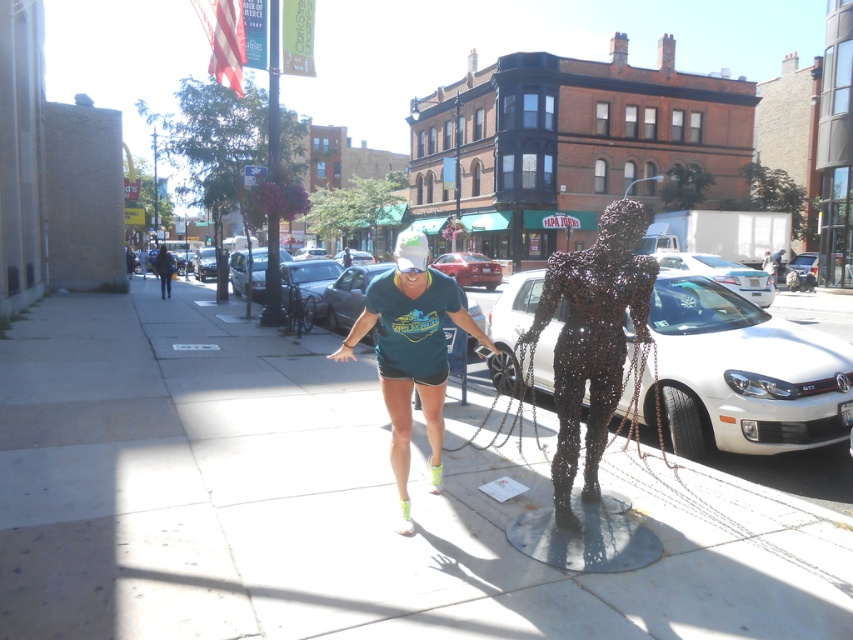
Consider the image. You are standing at the center of the street and want to reach the white metallic car at center. Which direction should you walk to get there?

The white metallic car at center is located at point (743, 372), so you should walk towards the lower right direction to reach it.

You are a pedestrian standing at the camera position. There is a white metallic car at center. Can you safely cross the street to reach the sculpture on the right without getting too close to the car?

The white metallic car at center is 7.49 meters away from the camera. Since 7.49 meters is a safe distance, you can safely cross the street to reach the sculpture on the right without getting too close to the car.

You are a delivery person who needs to park your 2.5 meters wide delivery van. You see two cars parked at the center of the street, a white metallic car at center and a white glossy car at center. Which car should you choose to park next to so that your van fits between them?

The white metallic car at center has a width less than the white glossy car at center. Therefore, the space between the white metallic car at center and the white glossy car at center may be sufficient for your 2.5 meters wide delivery van. However, without knowing the exact distance between the cars, it is impossible to determine which car to choose based solely on their widths.